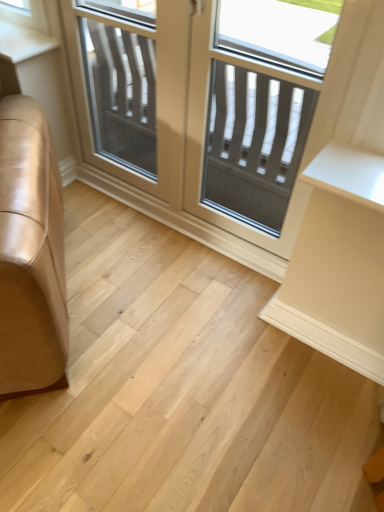
The height and width of the screenshot is (512, 384). Describe the element at coordinates (236, 111) in the screenshot. I see `clear glass door at center` at that location.

Find the location of a particular element. clear glass door at center is located at coordinates (236, 111).

The width and height of the screenshot is (384, 512). In order to click on natural wood floor at lower left in this screenshot , I will do `click(182, 388)`.

Which is closer to the camera, (x=184, y=33) or (x=323, y=494)?

Point (x=184, y=33) is positioned farther from the camera compared to point (x=323, y=494).

Which of these two, clear glass screen door at center, placed as the second screen door when sorted from right to left, or natural wood floor at lower left, is wider?

With larger width is natural wood floor at lower left.

From the image's perspective, which one is positioned lower, clear glass screen door at center, which ranks as the 1th screen door in left-to-right order, or natural wood floor at lower left?

From the image's view, natural wood floor at lower left is below.

Is clear glass screen door at center, which ranks as the 1th screen door in left-to-right order, not close to natural wood floor at lower left?

That's not correct — clear glass screen door at center, which ranks as the 1th screen door in left-to-right order, is a little close to natural wood floor at lower left.

Which is more distant, (x=254, y=219) or (x=138, y=384)?

The point (x=254, y=219) is farther from the camera.

Where is `stairwell to the left of matte gray screen door at center, arranged as the first screen door when viewed from the right`? The image size is (384, 512). stairwell to the left of matte gray screen door at center, arranged as the first screen door when viewed from the right is located at coordinates (182, 388).

From a real-world perspective, is matte gray screen door at center, which is the second screen door in left-to-right order, located beneath natural wood floor at lower left?

No, from a real-world perspective, matte gray screen door at center, which is the second screen door in left-to-right order, is not below natural wood floor at lower left.

Which of these two, matte gray screen door at center, arranged as the first screen door when viewed from the right, or natural wood floor at lower left, is wider?

natural wood floor at lower left.

Is clear glass door at center directly adjacent to natural wood floor at lower left?

They are not placed beside each other.

Is clear glass door at center turned away from natural wood floor at lower left?

No, natural wood floor at lower left is not at the back of clear glass door at center.

In the scene shown: From a real-world perspective, which is physically below, clear glass door at center or natural wood floor at lower left?

From a 3D spatial view, natural wood floor at lower left is below.

Find the location of a particular element. Image resolution: width=384 pixels, height=512 pixels. window above the natural wood floor at lower left (from a real-world perspective) is located at coordinates click(x=236, y=111).

Is clear glass screen door at center, placed as the second screen door when sorted from right to left, to the right of matte gray screen door at center, which is the second screen door in left-to-right order, from the viewer's perspective?

No.

Is clear glass screen door at center, which ranks as the 1th screen door in left-to-right order, wider or thinner than matte gray screen door at center, arranged as the first screen door when viewed from the right?

Clearly, clear glass screen door at center, which ranks as the 1th screen door in left-to-right order, has more width compared to matte gray screen door at center, arranged as the first screen door when viewed from the right.

Is point (113, 131) behind point (253, 92)?

Yes.

How distant is clear glass screen door at center, placed as the second screen door when sorted from right to left, from matte gray screen door at center, which is the second screen door in left-to-right order?

clear glass screen door at center, placed as the second screen door when sorted from right to left, is 34.41 centimeters from matte gray screen door at center, which is the second screen door in left-to-right order.

Would you say natural wood floor at lower left is outside clear glass door at center?

natural wood floor at lower left is positioned outside clear glass door at center.

Are natural wood floor at lower left and clear glass door at center making contact?

natural wood floor at lower left is not next to clear glass door at center, and they're not touching.

Based on the photo, can you confirm if natural wood floor at lower left is positioned to the left of clear glass door at center?

Indeed, natural wood floor at lower left is positioned on the left side of clear glass door at center.

In the scene shown: Can you confirm if clear glass screen door at center, placed as the second screen door when sorted from right to left, is bigger than clear glass door at center?

No.

Is clear glass screen door at center, which ranks as the 1th screen door in left-to-right order, turned away from clear glass door at center?

Yes.

Based on the photo, which object is thinner, clear glass screen door at center, which ranks as the 1th screen door in left-to-right order, or clear glass door at center?

clear glass door at center.

Is point (244, 196) closer or farther from the camera than point (267, 102)?

Clearly, point (244, 196) is more distant from the camera than point (267, 102).

Identify the location of window on the left of matte gray screen door at center, which is the second screen door in left-to-right order. The width and height of the screenshot is (384, 512). (236, 111).

From the image's perspective, is clear glass door at center above matte gray screen door at center, which is the second screen door in left-to-right order?

Yes, from the image's perspective, clear glass door at center is above matte gray screen door at center, which is the second screen door in left-to-right order.

Is clear glass door at center at the left side of matte gray screen door at center, which is the second screen door in left-to-right order?

Correct, you'll find clear glass door at center to the left of matte gray screen door at center, which is the second screen door in left-to-right order.

This screenshot has height=512, width=384. Find the location of `stairwell in front of the clear glass screen door at center, which ranks as the 1th screen door in left-to-right order`. stairwell in front of the clear glass screen door at center, which ranks as the 1th screen door in left-to-right order is located at coordinates (182, 388).

You are a GUI agent. You are given a task and a screenshot of the screen. Output one action in this format:
    pyautogui.click(x=<x>, y=<y>)
    Task: Click on the 2nd screen door directly above the natural wood floor at lower left (from a real-world perspective)
    This screenshot has height=512, width=384.
    Given the screenshot: What is the action you would take?
    pyautogui.click(x=262, y=104)

Based on their spatial positions, is clear glass screen door at center, which ranks as the 1th screen door in left-to-right order, or matte gray screen door at center, which is the second screen door in left-to-right order, closer to clear glass door at center?

Based on the image, matte gray screen door at center, which is the second screen door in left-to-right order, appears to be nearer to clear glass door at center.

Looking at this image, which object lies further to the anchor point clear glass screen door at center, which ranks as the 1th screen door in left-to-right order, natural wood floor at lower left or matte gray screen door at center, arranged as the first screen door when viewed from the right?

Based on the image, natural wood floor at lower left appears to be further to clear glass screen door at center, which ranks as the 1th screen door in left-to-right order.

Based on their spatial positions, is natural wood floor at lower left or clear glass screen door at center, which ranks as the 1th screen door in left-to-right order, closer to matte gray screen door at center, arranged as the first screen door when viewed from the right?

clear glass screen door at center, which ranks as the 1th screen door in left-to-right order, is closer to matte gray screen door at center, arranged as the first screen door when viewed from the right.

From the image, which object appears to be nearer to matte gray screen door at center, arranged as the first screen door when viewed from the right, clear glass door at center or natural wood floor at lower left?

Among the two, clear glass door at center is located nearer to matte gray screen door at center, arranged as the first screen door when viewed from the right.

Based on their spatial positions, is clear glass door at center or clear glass screen door at center, which ranks as the 1th screen door in left-to-right order, closer to matte gray screen door at center, arranged as the first screen door when viewed from the right?

clear glass door at center lies closer to matte gray screen door at center, arranged as the first screen door when viewed from the right, than the other object.

In the scene shown: From the image, which object appears to be nearer to clear glass door at center, natural wood floor at lower left or clear glass screen door at center, which ranks as the 1th screen door in left-to-right order?

clear glass screen door at center, which ranks as the 1th screen door in left-to-right order, is closer to clear glass door at center.

When comparing their distances from clear glass door at center, does matte gray screen door at center, arranged as the first screen door when viewed from the right, or natural wood floor at lower left seem closer?

matte gray screen door at center, arranged as the first screen door when viewed from the right, lies closer to clear glass door at center than the other object.

Estimate the real-world distances between objects in this image. Which object is closer to natural wood floor at lower left, matte gray screen door at center, arranged as the first screen door when viewed from the right, or clear glass door at center?

clear glass door at center.

This screenshot has width=384, height=512. What are the coordinates of `window between clear glass screen door at center, which ranks as the 1th screen door in left-to-right order, and matte gray screen door at center, arranged as the first screen door when viewed from the right, in the horizontal direction` in the screenshot? It's located at (236, 111).

Identify the location of screen door between clear glass door at center and natural wood floor at lower left in the up-down direction. The image size is (384, 512). (262, 104).

Identify the location of screen door between clear glass screen door at center, placed as the second screen door when sorted from right to left, and natural wood floor at lower left in the up-down direction. Image resolution: width=384 pixels, height=512 pixels. (262, 104).

You are a GUI agent. You are given a task and a screenshot of the screen. Output one action in this format:
    pyautogui.click(x=<x>, y=<y>)
    Task: Click on the window that lies between clear glass screen door at center, which ranks as the 1th screen door in left-to-right order, and natural wood floor at lower left from top to bottom
    
    Given the screenshot: What is the action you would take?
    pyautogui.click(x=236, y=111)